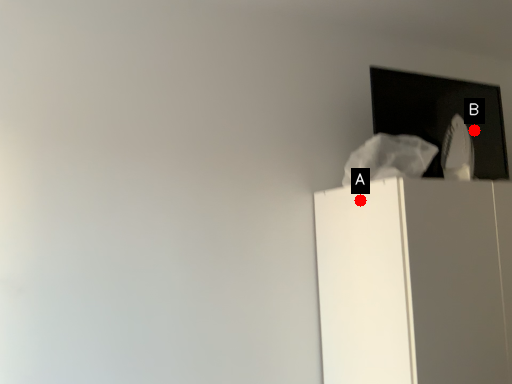
Question: Two points are circled on the image, labeled by A and B beside each circle. Which of the following is the closest to the observer?

Choices:
 (A) A is closer
 (B) B is closer

Answer: (A)